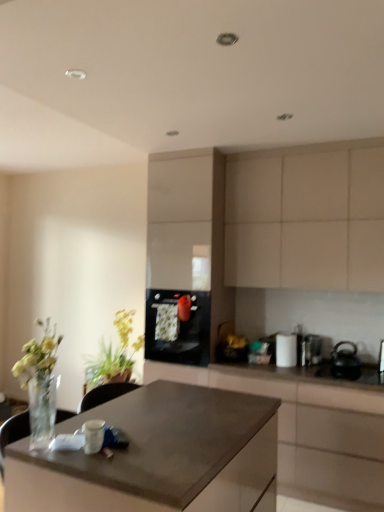
Question: Can you confirm if white glossy canister at upper right, which is counted as the third appliance, starting from the right, is wider than matte brown desk at center?

Choices:
 (A) no
 (B) yes

Answer: (A)

Question: Is matte brown desk at center at the back of white glossy canister at upper right, which is counted as the third appliance, starting from the right?

Choices:
 (A) no
 (B) yes

Answer: (A)

Question: Is white glossy canister at upper right, which appears as the first appliance when viewed from the left, positioned behind matte brown desk at center?

Choices:
 (A) yes
 (B) no

Answer: (A)

Question: Does white glossy canister at upper right, which is counted as the third appliance, starting from the right, appear on the left side of matte brown desk at center?

Choices:
 (A) yes
 (B) no

Answer: (B)

Question: From a real-world perspective, is white glossy canister at upper right, which appears as the first appliance when viewed from the left, physically below matte brown desk at center?

Choices:
 (A) no
 (B) yes

Answer: (A)

Question: Is point (345, 349) positioned closer to the camera than point (309, 387)?

Choices:
 (A) farther
 (B) closer

Answer: (A)

Question: From the image's perspective, relative to matte black countertop at center, the 2th cabinetry when ordered from top to bottom, is black glossy sink at lower right above or below?

Choices:
 (A) above
 (B) below

Answer: (A)

Question: Considering the positions of black glossy sink at lower right and matte black countertop at center, the first cabinetry in the bottom-to-top sequence, in the image, is black glossy sink at lower right bigger or smaller than matte black countertop at center, the first cabinetry in the bottom-to-top sequence,?

Choices:
 (A) small
 (B) big

Answer: (A)

Question: Looking at their shapes, would you say black glossy sink at lower right is wider or thinner than matte black countertop at center, the first cabinetry in the bottom-to-top sequence?

Choices:
 (A) thin
 (B) wide

Answer: (A)

Question: Based on their sizes in the image, would you say matte black countertop at center, the first cabinetry in the bottom-to-top sequence, is bigger or smaller than black glossy oven at center?

Choices:
 (A) big
 (B) small

Answer: (A)

Question: Visually, is matte black countertop at center, the 2th cabinetry when ordered from top to bottom, positioned to the left or to the right of black glossy oven at center?

Choices:
 (A) left
 (B) right

Answer: (B)

Question: Is point (283, 485) closer or farther from the camera than point (157, 347)?

Choices:
 (A) closer
 (B) farther

Answer: (A)

Question: Is matte black countertop at center, the first cabinetry in the bottom-to-top sequence, taller or shorter than black glossy oven at center?

Choices:
 (A) short
 (B) tall

Answer: (B)

Question: Is black glossy oven at center spatially inside white glossy canister at upper right, which is counted as the third appliance, starting from the right, or outside of it?

Choices:
 (A) outside
 (B) inside

Answer: (A)

Question: In terms of height, does black glossy oven at center look taller or shorter compared to white glossy canister at upper right, which is counted as the third appliance, starting from the right?

Choices:
 (A) tall
 (B) short

Answer: (A)